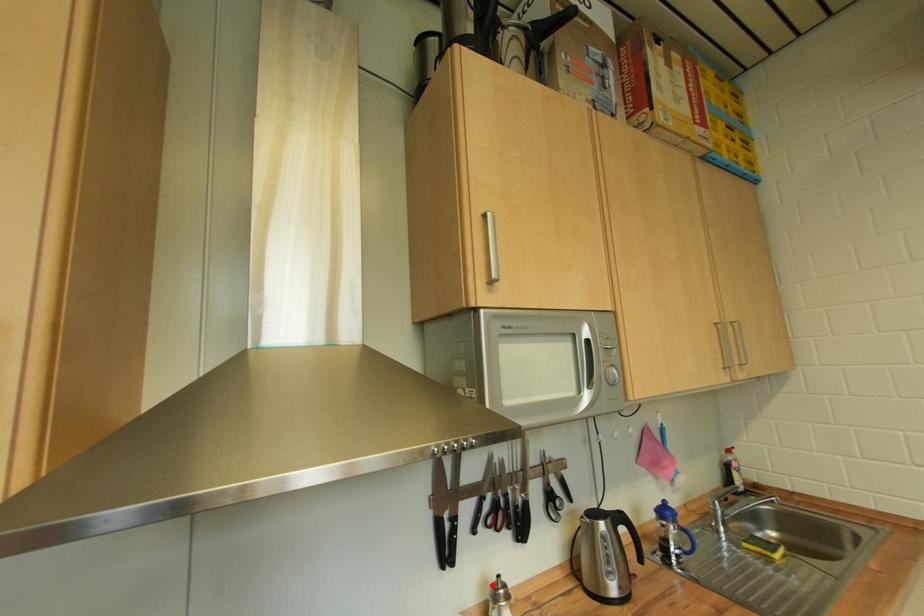
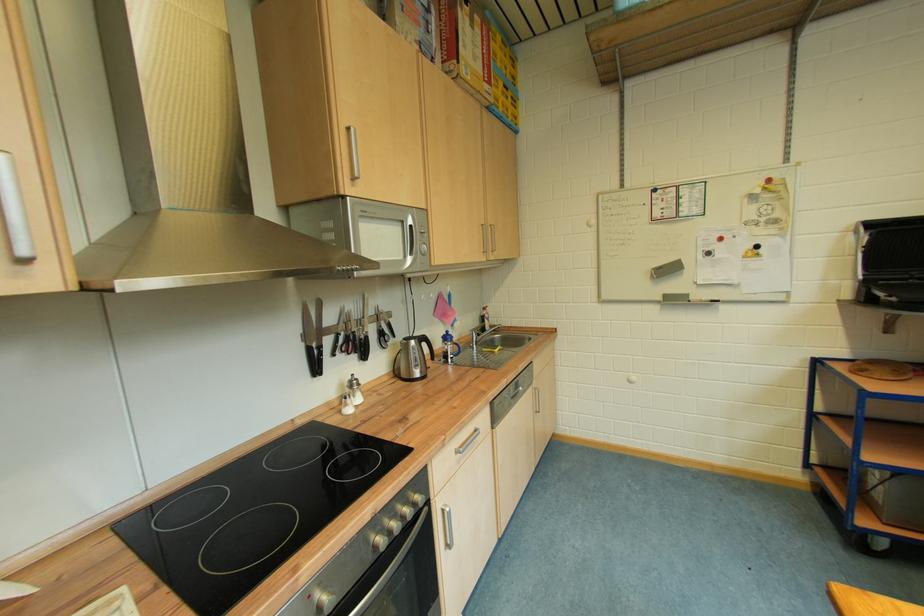
The point at the highlighted location is marked in the first image. Where is the corresponding point in the second image?

(349, 387)